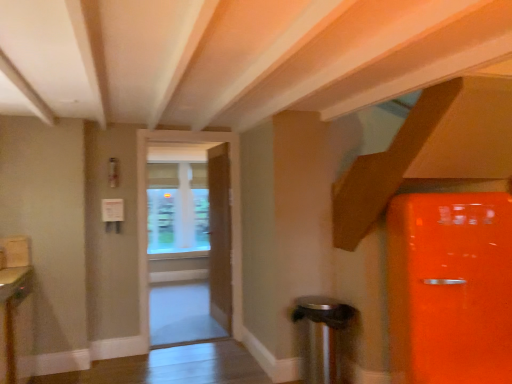
Question: Is point (9, 288) closer or farther from the camera than point (323, 339)?

Choices:
 (A) closer
 (B) farther

Answer: (A)

Question: From the image's perspective, is matte wood cabinet at lower left positioned above or below satin silver trash can at lower right?

Choices:
 (A) above
 (B) below

Answer: (A)

Question: Estimate the real-world distances between objects in this image. Which object is closer to the transparent glass window at center?

Choices:
 (A) white glossy door at center, positioned as the first door in front-to-back order
 (B) matte wood cabinet at lower left
 (C) wooden door at center, the 1th door from the back
 (D) satin silver trash can at lower right

Answer: (C)

Question: Which of these objects is positioned farthest from the satin silver trash can at lower right?

Choices:
 (A) wooden door at center, the 1th door from the back
 (B) transparent glass window at center
 (C) matte wood cabinet at lower left
 (D) white glossy door at center, positioned as the first door in front-to-back order

Answer: (B)